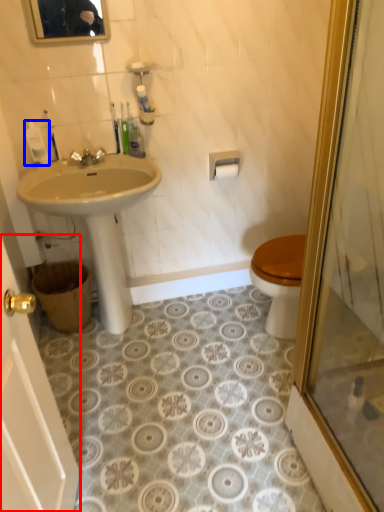
Question: Which object appears farthest to the camera in this image, screen door (highlighted by a red box) or toiletry (highlighted by a blue box)?

Choices:
 (A) screen door
 (B) toiletry

Answer: (B)